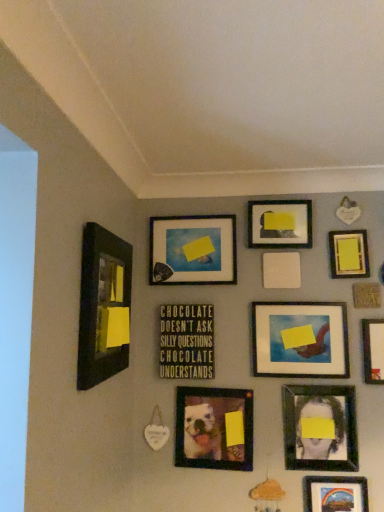
Question: From a real-world perspective, is matte wood picture frame at center, the 3th picture frame positioned from the back, over metallic rainbow landscape at bottom right, arranged as the second picture frame when viewed from the front?

Choices:
 (A) no
 (B) yes

Answer: (B)

Question: Considering the relative sizes of matte wood picture frame at center, the 9th picture frame when ordered from front to back, and metallic rainbow landscape at bottom right, arranged as the second picture frame when viewed from the front, in the image provided, is matte wood picture frame at center, the 9th picture frame when ordered from front to back, thinner than metallic rainbow landscape at bottom right, arranged as the second picture frame when viewed from the front,?

Choices:
 (A) yes
 (B) no

Answer: (A)

Question: Is matte wood picture frame at center, the 9th picture frame when ordered from front to back, bigger than metallic rainbow landscape at bottom right, the tenth picture frame positioned from the back?

Choices:
 (A) no
 (B) yes

Answer: (A)

Question: Is the surface of matte wood picture frame at center, the 9th picture frame when ordered from front to back, in direct contact with metallic rainbow landscape at bottom right, the tenth picture frame positioned from the back?

Choices:
 (A) yes
 (B) no

Answer: (B)

Question: Is matte wood picture frame at center, the 9th picture frame when ordered from front to back, closer to camera compared to metallic rainbow landscape at bottom right, the tenth picture frame positioned from the back?

Choices:
 (A) no
 (B) yes

Answer: (A)

Question: Is metallic rainbow landscape at bottom right, arranged as the second picture frame when viewed from the front, to the left or to the right of matte black picture frame at left, the first picture frame viewed from the front, in the image?

Choices:
 (A) left
 (B) right

Answer: (B)

Question: Which is correct: metallic rainbow landscape at bottom right, the tenth picture frame positioned from the back, is inside matte black picture frame at left, the first picture frame viewed from the front, or outside of it?

Choices:
 (A) outside
 (B) inside

Answer: (A)

Question: From their relative heights in the image, would you say metallic rainbow landscape at bottom right, the tenth picture frame positioned from the back, is taller or shorter than matte black picture frame at left, the 11th picture frame in the back-to-front sequence?

Choices:
 (A) short
 (B) tall

Answer: (A)

Question: Considering the positions of metallic rainbow landscape at bottom right, arranged as the second picture frame when viewed from the front, and matte black picture frame at left, the 11th picture frame in the back-to-front sequence, in the image, is metallic rainbow landscape at bottom right, arranged as the second picture frame when viewed from the front, bigger or smaller than matte black picture frame at left, the 11th picture frame in the back-to-front sequence,?

Choices:
 (A) small
 (B) big

Answer: (A)

Question: Considering the positions of matte wood picture frame at center, the 9th picture frame when ordered from front to back, and white matte picture frame at upper right, which is counted as the 9th picture frame, starting from the back, in the image, is matte wood picture frame at center, the 9th picture frame when ordered from front to back, taller or shorter than white matte picture frame at upper right, which is counted as the 9th picture frame, starting from the back,?

Choices:
 (A) short
 (B) tall

Answer: (A)

Question: Considering their positions, is matte wood picture frame at center, the 9th picture frame when ordered from front to back, located in front of or behind white matte picture frame at upper right, the 3th picture frame positioned from the front?

Choices:
 (A) front
 (B) behind

Answer: (B)

Question: In terms of width, does matte wood picture frame at center, the 3th picture frame positioned from the back, look wider or thinner when compared to white matte picture frame at upper right, the 3th picture frame positioned from the front?

Choices:
 (A) wide
 (B) thin

Answer: (A)

Question: From the image's perspective, relative to white matte picture frame at upper right, which is counted as the 9th picture frame, starting from the back, is matte wood picture frame at center, the 9th picture frame when ordered from front to back, above or below?

Choices:
 (A) above
 (B) below

Answer: (A)

Question: Based on their sizes in the image, would you say matte black frame at upper center, arranged as the second picture frame when viewed from the back, is bigger or smaller than yellow matte picture frame at upper right, which ranks as the fifth picture frame in back-to-front order?

Choices:
 (A) small
 (B) big

Answer: (B)

Question: Based on their positions, is matte black frame at upper center, arranged as the second picture frame when viewed from the back, located to the left or right of yellow matte picture frame at upper right, positioned as the seventh picture frame in front-to-back order?

Choices:
 (A) right
 (B) left

Answer: (B)